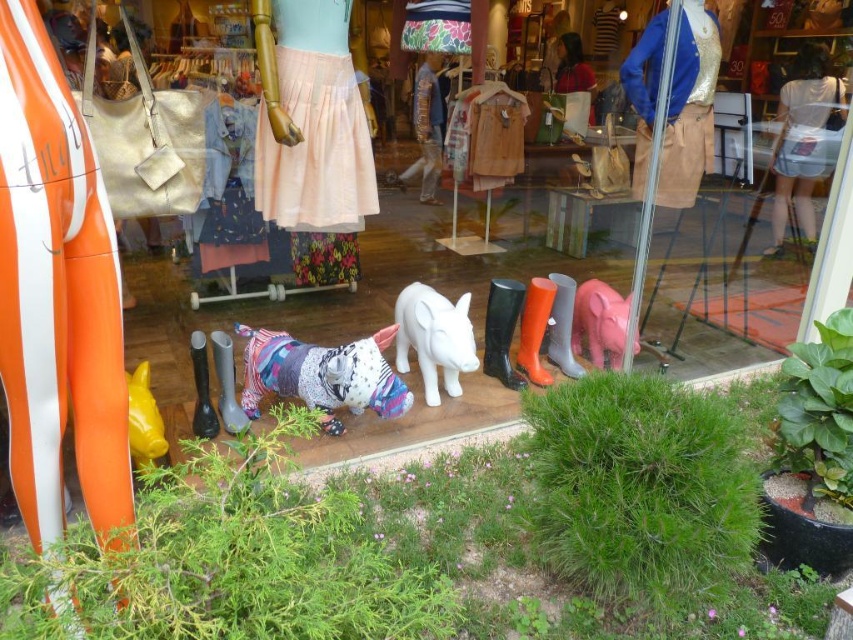
Question: Does peach satin skirt at center lie behind knitted sweater at center?

Choices:
 (A) yes
 (B) no

Answer: (B)

Question: Estimate the real-world distances between objects in this image. Which object is farther from the peach satin skirt at center?

Choices:
 (A) white glossy pig at center
 (B) floral fabric dress at center
 (C) knitted sweater at center
 (D) blue sequined jacket at upper right

Answer: (B)

Question: Which point is farther to the camera?

Choices:
 (A) (798, 99)
 (B) (431, 356)
 (C) (293, 176)

Answer: (A)

Question: Which object is the farthest from the peach satin skirt at center?

Choices:
 (A) white cotton blouse at upper right
 (B) knitted sweater at center
 (C) floral fabric dress at center
 (D) blue sequined jacket at upper right

Answer: (C)

Question: Does blue sequined jacket at upper right have a lesser width compared to white cotton blouse at upper right?

Choices:
 (A) no
 (B) yes

Answer: (A)

Question: Is peach satin skirt at center thinner than floral fabric dress at center?

Choices:
 (A) no
 (B) yes

Answer: (A)